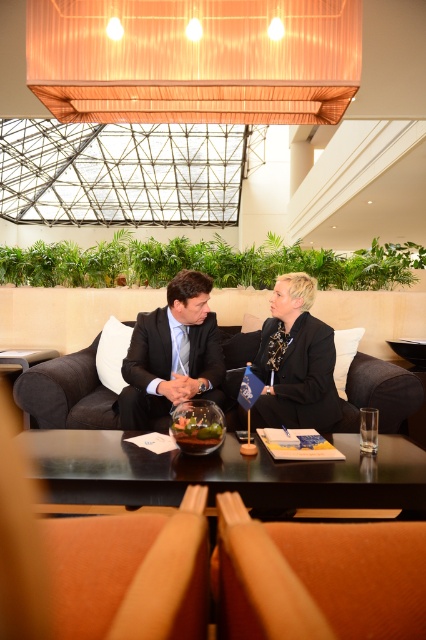
Question: Which object appears closest to the camera in this image?

Choices:
 (A) dark blue fabric business suit at center
 (B) black suit at center
 (C) black matte suit at center

Answer: (B)

Question: Does black glass table at center have a smaller size compared to black suit at center?

Choices:
 (A) yes
 (B) no

Answer: (A)

Question: Which object is closer to the camera taking this photo?

Choices:
 (A) black suit at center
 (B) black glass table at center
 (C) dark blue fabric business suit at center

Answer: (B)

Question: Does black matte suit at center lie behind dark blue fabric business suit at center?

Choices:
 (A) no
 (B) yes

Answer: (B)

Question: Among these points, which one is nearest to the camera?

Choices:
 (A) (69, 483)
 (B) (196, 332)

Answer: (A)

Question: Is black suit at center to the right of black matte suit at center from the viewer's perspective?

Choices:
 (A) yes
 (B) no

Answer: (B)